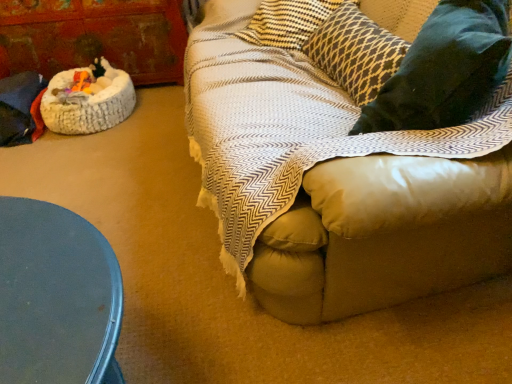
Locate an element on the screen. This screenshot has height=384, width=512. free space in front of white fluffy cat bed at left is located at coordinates (91, 153).